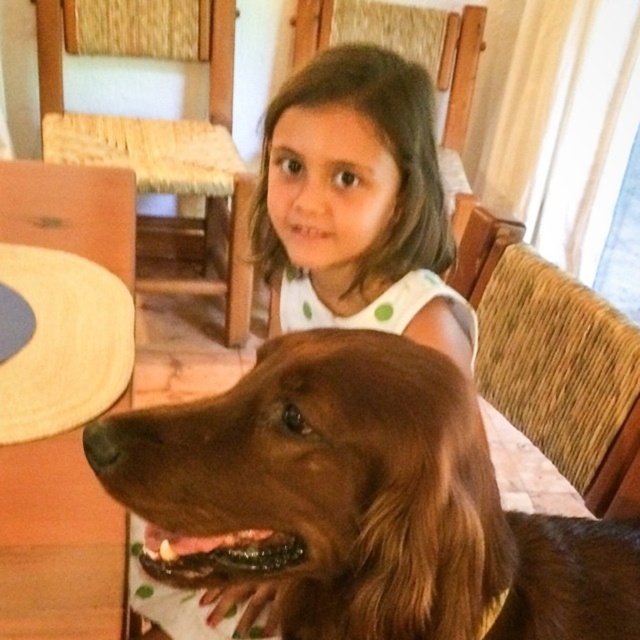
You are a delivery person who needs to place a package between the brown furry dog at center and the woven wood chair at upper left. The package requires 6 feet of space. Can you fit it between them?

The distance between the brown furry dog at center and the woven wood chair at upper left is 5.84 feet, which is less than 6 feet. Therefore, the package cannot be placed between them as there isn t enough space.

In the scene shown: Based on the scene, which object is positioned higher relative to the other? The smooth brown hair at center or the woven wood chair at right?

The smooth brown hair at center is located above the woven wood chair at right, so it is positioned higher.